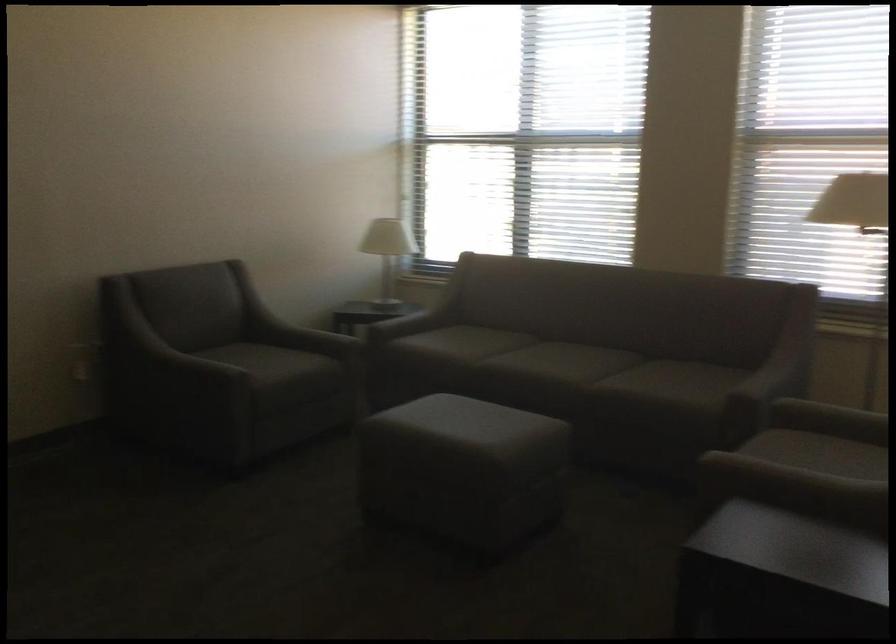
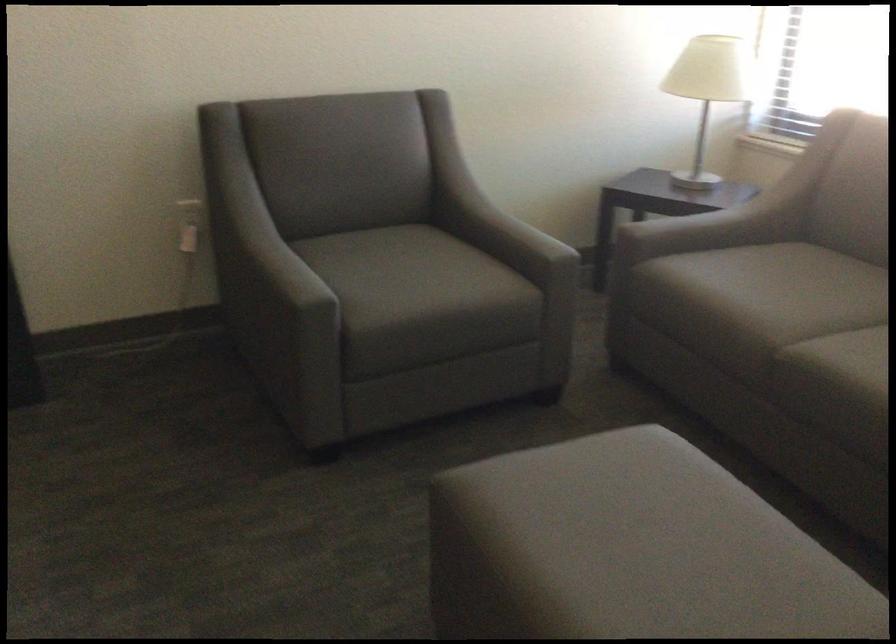
Locate, in the second image, the point that corresponds to point (390, 243) in the first image.

(708, 90)